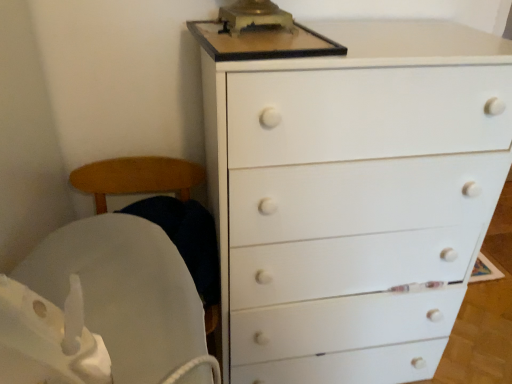
I want to click on white matte chest of drawers at upper right, so click(353, 197).

Describe the element at coordinates (353, 197) in the screenshot. I see `white matte chest of drawers at upper right` at that location.

Image resolution: width=512 pixels, height=384 pixels. Find the location of `white fabric rocking chair at left`. white fabric rocking chair at left is located at coordinates (126, 294).

Describe the element at coordinates (126, 294) in the screenshot. I see `white fabric rocking chair at left` at that location.

Based on the photo, in order to face white fabric rocking chair at left, should I rotate leftwards or rightwards?

You should look left and rotate roughly 14.543 degrees.

What are the coordinates of `white matte chest of drawers at upper right` in the screenshot? It's located at (353, 197).

Is white fabric rocking chair at left at the left side of white matte chest of drawers at upper right?

Yes.

Considering their positions, is white fabric rocking chair at left located in front of or behind white matte chest of drawers at upper right?

In the image, white fabric rocking chair at left appears behind white matte chest of drawers at upper right.

Does point (93, 259) come farther from viewer compared to point (271, 176)?

No, it is not.

From the image's perspective, is white fabric rocking chair at left over white matte chest of drawers at upper right?

Actually, white fabric rocking chair at left appears below white matte chest of drawers at upper right in the image.

From a real-world perspective, is white fabric rocking chair at left beneath white matte chest of drawers at upper right?

Indeed, from a real-world perspective, white fabric rocking chair at left is positioned beneath white matte chest of drawers at upper right.

Looking at their sizes, would you say white fabric rocking chair at left is wider or thinner than white matte chest of drawers at upper right?

Clearly, white fabric rocking chair at left has less width compared to white matte chest of drawers at upper right.

Considering the sizes of white fabric rocking chair at left and white matte chest of drawers at upper right in the image, is white fabric rocking chair at left taller or shorter than white matte chest of drawers at upper right?

Clearly, white fabric rocking chair at left is shorter compared to white matte chest of drawers at upper right.

Who is smaller, white fabric rocking chair at left or white matte chest of drawers at upper right?

Smaller between the two is white fabric rocking chair at left.

Choose the correct answer: Is white fabric rocking chair at left inside white matte chest of drawers at upper right or outside it?

white fabric rocking chair at left is outside white matte chest of drawers at upper right.

Is white fabric rocking chair at left far from white matte chest of drawers at upper right?

No, white fabric rocking chair at left is in close proximity to white matte chest of drawers at upper right.

Is white fabric rocking chair at left oriented away from white matte chest of drawers at upper right?

No, white fabric rocking chair at left is not facing away from white matte chest of drawers at upper right.

Image resolution: width=512 pixels, height=384 pixels. Identify the location of chest of drawers that appears on the right of white fabric rocking chair at left. (353, 197).

Between white matte chest of drawers at upper right and white fabric rocking chair at left, which one appears on the left side from the viewer's perspective?

Positioned to the left is white fabric rocking chair at left.

Which object is further away from the camera taking this photo, white matte chest of drawers at upper right or white fabric rocking chair at left?

white fabric rocking chair at left is further from the camera.

Considering the points (217, 215) and (165, 246), which point is in front, point (217, 215) or point (165, 246)?

The point (165, 246) is more forward.

From the image's perspective, is white matte chest of drawers at upper right located above or below white fabric rocking chair at left?

From the image's perspective, white matte chest of drawers at upper right appears above white fabric rocking chair at left.

From a real-world perspective, who is located lower, white matte chest of drawers at upper right or white fabric rocking chair at left?

white fabric rocking chair at left is physically lower.

Which object is thinner, white matte chest of drawers at upper right or white fabric rocking chair at left?

With smaller width is white fabric rocking chair at left.

Who is taller, white matte chest of drawers at upper right or white fabric rocking chair at left?

white matte chest of drawers at upper right.

Which of these two, white matte chest of drawers at upper right or white fabric rocking chair at left, is smaller?

Smaller between the two is white fabric rocking chair at left.

Is white matte chest of drawers at upper right located outside white fabric rocking chair at left?

white matte chest of drawers at upper right lies outside white fabric rocking chair at left's area.

Is white matte chest of drawers at upper right in contact with white fabric rocking chair at left?

No, white matte chest of drawers at upper right is not next to white fabric rocking chair at left.

Is white matte chest of drawers at upper right facing towards white fabric rocking chair at left?

No, white matte chest of drawers at upper right is not turned towards white fabric rocking chair at left.

What's the angular difference between white matte chest of drawers at upper right and white fabric rocking chair at left's facing directions?

The angle between the facing direction of white matte chest of drawers at upper right and the facing direction of white fabric rocking chair at left is 0.533 degrees.

The height and width of the screenshot is (384, 512). Identify the location of rocking chair that is on the left side of white matte chest of drawers at upper right. (126, 294).

You are a GUI agent. You are given a task and a screenshot of the screen. Output one action in this format:
    pyautogui.click(x=<x>, y=<y>)
    Task: Click on the rocking chair on the left of white matte chest of drawers at upper right
    
    Given the screenshot: What is the action you would take?
    pyautogui.click(x=126, y=294)

The image size is (512, 384). What are the coordinates of `the chest of drawers lying above the white fabric rocking chair at left (from the image's perspective)` in the screenshot? It's located at (353, 197).